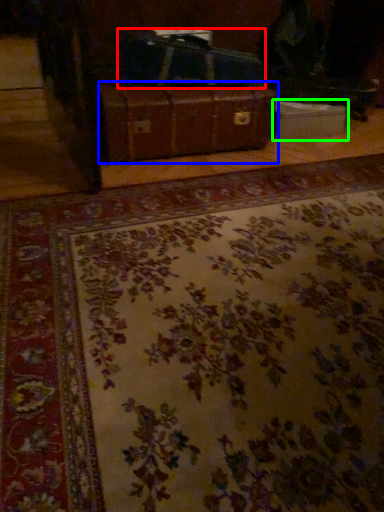
Question: Which object is positioned closest to luggage (highlighted by a red box)? Select from suitcase (highlighted by a blue box) and cardboard box (highlighted by a green box).

Choices:
 (A) suitcase
 (B) cardboard box

Answer: (A)